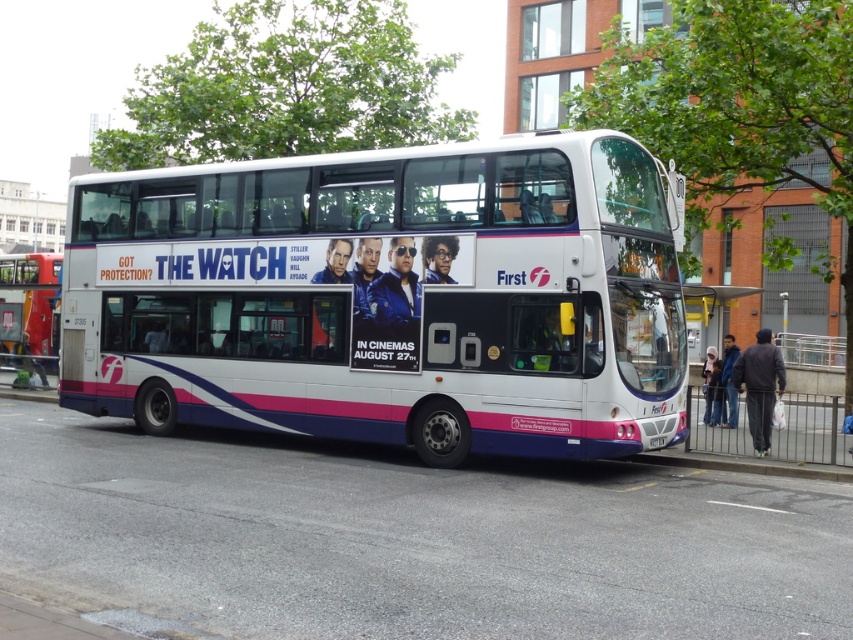
You are a delivery person who needs to load a package onto a truck that is 12 meters long. You see the white glossy decker bus at center and the white plastic bus at left. Can you safely maneuver the truck between them without hitting either bus?

The distance between the white glossy decker bus at center and the white plastic bus at left is 13.21 meters. Since the truck is 12 meters long, there is enough space to maneuver between them safely.

You are a delivery person trying to load a package onto the roof of the white glossy decker bus at center. The package is 1.2 meters tall. Can you safely place it there without exceeding the height limit? Consider the height of the white plastic license plate at center as a reference point.

The white glossy decker bus at center is taller than the white plastic license plate at center. Since the license plate is a reference point, but the exact height difference isn